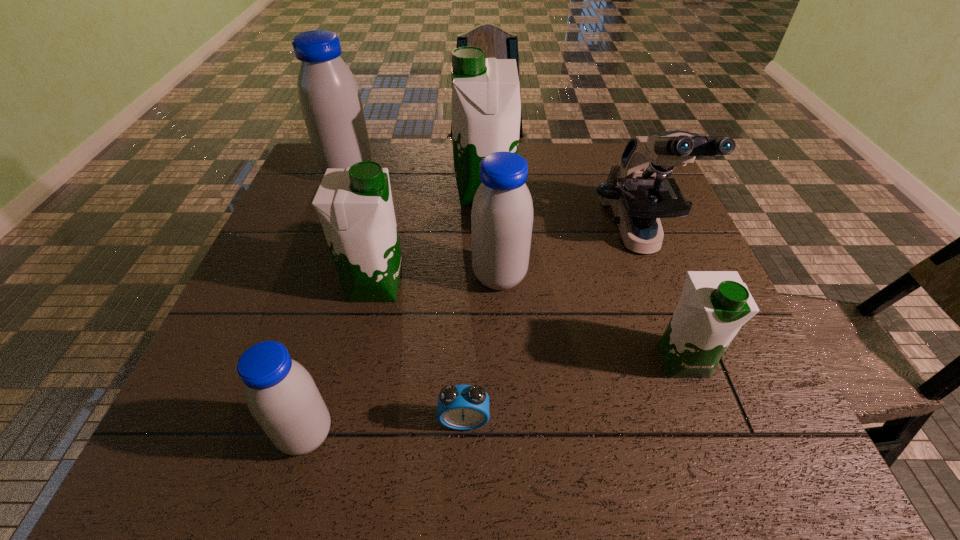
Locate an element on the screen. The height and width of the screenshot is (540, 960). empty location between the nearest soya milk and the microscope is located at coordinates click(x=472, y=335).

Locate which object ranks fifth in proximity to the smallest blue soya milk. Please provide its 2D coordinates. Your answer should be formatted as a tuple, i.e. [(x, y)], where the tuple contains the x and y coordinates of a point satisfying the conditions above.

[(486, 107)]

Where is `object that is the fourth closest one to the second nearest soya milk`? object that is the fourth closest one to the second nearest soya milk is located at coordinates coord(486,107).

Identify the location of soya milk identified as the fourth closest to the biggest blue soya milk. The width and height of the screenshot is (960, 540). (281, 395).

Select which soya milk is the fifth closest to the rightmost green soya milk. Please provide its 2D coordinates. Your answer should be formatted as a tuple, i.e. [(x, y)], where the tuple contains the x and y coordinates of a point satisfying the conditions above.

[(329, 97)]

Where is `green soya milk that is the second closest to the farthest green soya milk`? green soya milk that is the second closest to the farthest green soya milk is located at coordinates (714, 305).

You are a GUI agent. You are given a task and a screenshot of the screen. Output one action in this format:
    pyautogui.click(x=<x>, y=<y>)
    Task: Click on the green soya milk that is the second closest to the alarm clock
    The height and width of the screenshot is (540, 960).
    Given the screenshot: What is the action you would take?
    pyautogui.click(x=714, y=305)

Identify the location of blue soya milk that stands as the second closest to the second biggest blue soya milk. This screenshot has height=540, width=960. (329, 97).

You are a GUI agent. You are given a task and a screenshot of the screen. Output one action in this format:
    pyautogui.click(x=<x>, y=<y>)
    Task: Click on the blue soya milk that can be found as the second closest to the farthest blue soya milk
    The width and height of the screenshot is (960, 540).
    Given the screenshot: What is the action you would take?
    pyautogui.click(x=281, y=395)

Locate an element on the screen. This screenshot has height=540, width=960. free space that satisfies the following two spatial constraints: 1. through the eyepieces of the microscope; 2. on the front-facing side of the leftmost green soya milk is located at coordinates (656, 285).